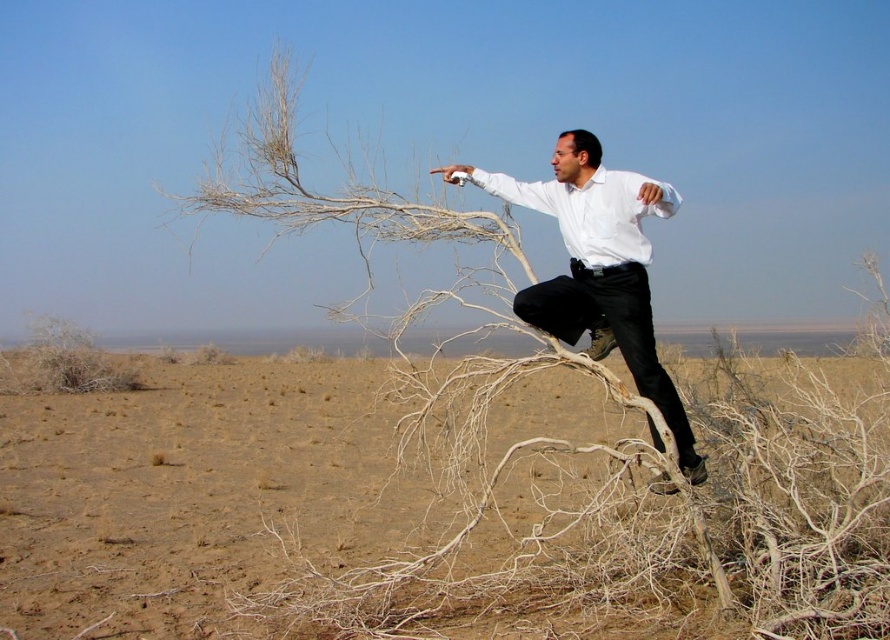
Is white matte shirt at center in front of white matte dress shirt at center?

Yes, it is in front of white matte dress shirt at center.

Is white matte shirt at center shorter than white matte dress shirt at center?

No, white matte shirt at center is not shorter than white matte dress shirt at center.

Between point (576, 168) and point (652, 180), which one is positioned in front?

Point (652, 180) is more forward.

This screenshot has width=890, height=640. Find the location of `white matte shirt at center`. white matte shirt at center is located at coordinates (597, 268).

Describe the element at coordinates (441, 508) in the screenshot. This screenshot has width=890, height=640. I see `brown sandy dirt at center` at that location.

Which is below, brown sandy dirt at center or white matte shirt at center?

brown sandy dirt at center is below.

You are a GUI agent. You are given a task and a screenshot of the screen. Output one action in this format:
    pyautogui.click(x=<x>, y=<y>)
    Task: Click on the brown sandy dirt at center
    
    Given the screenshot: What is the action you would take?
    pyautogui.click(x=441, y=508)

Where is `brown sandy dirt at center`? brown sandy dirt at center is located at coordinates pyautogui.click(x=441, y=508).

Based on the photo, which is more to the left, brown sandy dirt at center or white matte dress shirt at center?

brown sandy dirt at center

The image size is (890, 640). What are the coordinates of `brown sandy dirt at center` in the screenshot? It's located at (441, 508).